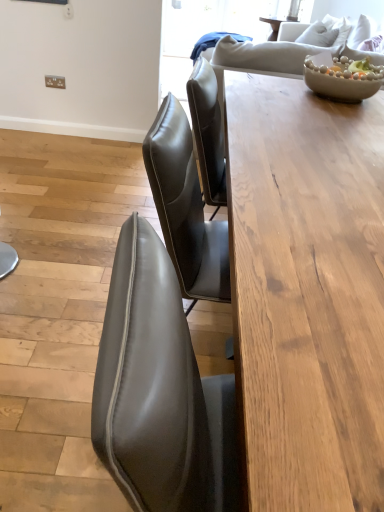
You are a GUI agent. You are given a task and a screenshot of the screen. Output one action in this format:
    pyautogui.click(x=<x>, y=<y>)
    Task: Click on the vacant point to the left of matte beige bowl at upper right
    Image resolution: width=384 pixels, height=512 pixels.
    Given the screenshot: What is the action you would take?
    pyautogui.click(x=267, y=89)